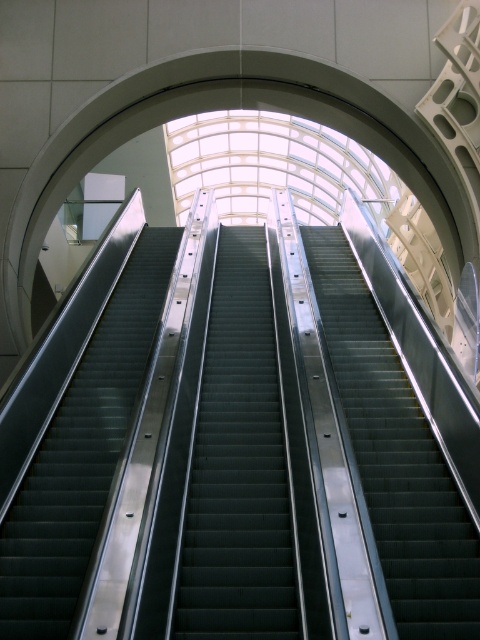
Question: Does metallic escalator steps at center appear over metallic silver escalator at left?

Choices:
 (A) no
 (B) yes

Answer: (A)

Question: Which point is farther from the camera taking this photo?

Choices:
 (A) (278, 577)
 (B) (133, 346)
 (C) (431, 560)

Answer: (B)

Question: Does metallic escalator steps at center have a smaller size compared to metallic silver escalator at left?

Choices:
 (A) no
 (B) yes

Answer: (B)

Question: Which of the following is the closest to the observer?

Choices:
 (A) (399, 481)
 (B) (129, 300)

Answer: (A)

Question: Which point is farther from the camera taking this photo?

Choices:
 (A) (34, 492)
 (B) (193, 518)
 (C) (414, 632)

Answer: (A)

Question: Is the position of metallic gray stairs at center more distant than that of metallic silver escalator at left?

Choices:
 (A) yes
 (B) no

Answer: (A)